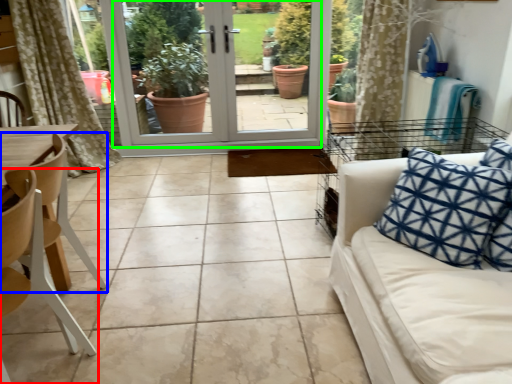
Question: Based on their relative distances, which object is nearer to chair (highlighted by a red box)? Choose from chair (highlighted by a blue box) and screen door (highlighted by a green box).

Choices:
 (A) chair
 (B) screen door

Answer: (A)